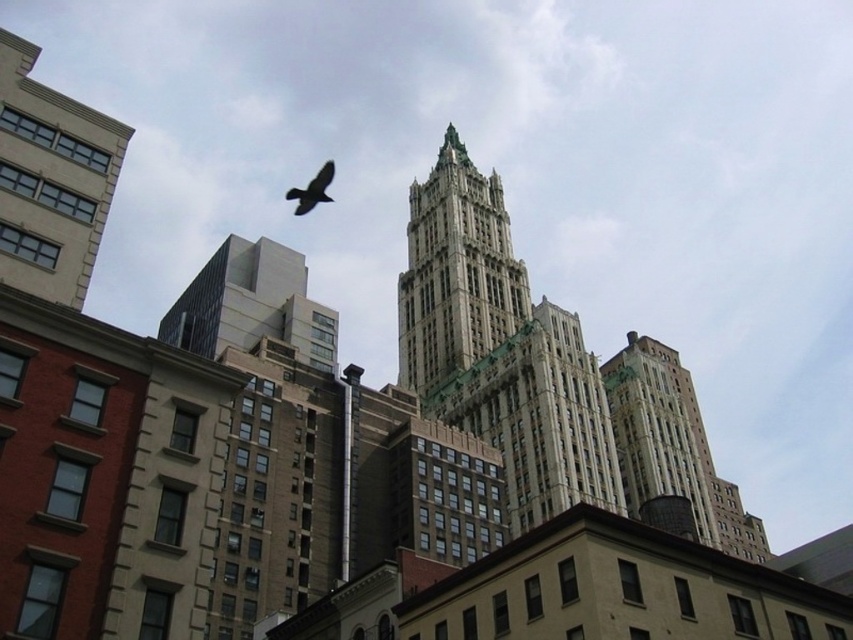
You are a drone operator who needs to fly a drone from the beige stone building at left to the gray stone tower at center. Based on the cityscape described, which direction should you fly the drone to reach the tower?

The beige stone building at left is below the gray stone tower at center, so you should fly the drone upward to reach the gray stone tower at center.

You are a drone operator tasked with flying a drone between the gray stone tower at center and the gray concrete building at upper left. The drone has a maximum flight distance of 50 meters. Can the drone successfully fly between them without running out of battery?

The distance between the gray stone tower at center and the gray concrete building at upper left is 42.90 meters, which is within the drone operator maximum flight distance of 50 meters. Therefore, the drone can successfully fly between them without running out of battery.

You are an urban planner assessing the city layout. You need to determine if the beige stone building at left can be expanded to the same width as the gray stone tower at center without violating zoning laws that require a minimum 2 meter gap between buildings. Can the expansion be done?

The beige stone building at left has a lesser width compared to gray stone tower at center. However, without knowing the exact distance between them or the current width of the beige building, it is impossible to determine if expansion is possible while maintaining the required 2 meter gap. Additional measurements are needed.